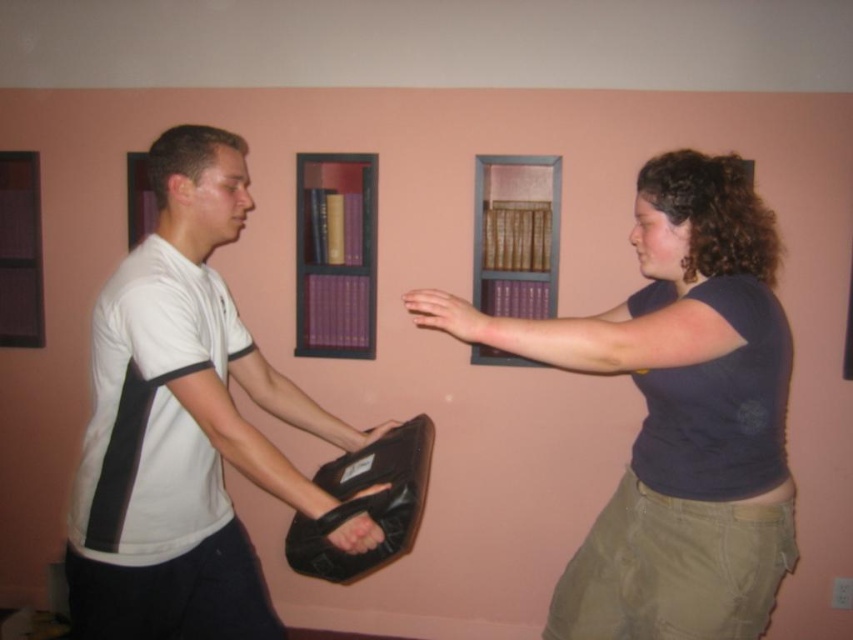
Is smooth skin hand at center positioned at the back of leather at center?

No.

Is smooth skin hand at center bigger than leather at center?

Yes, smooth skin hand at center is bigger than leather at center.

Image resolution: width=853 pixels, height=640 pixels. In order to click on smooth skin hand at center in this screenshot , I will do `click(450, 316)`.

This screenshot has width=853, height=640. Identify the location of purple matte bookshelf at upper center. (515, 234).

Does purple matte bookshelf at upper center appear on the right side of matte black bag at center?

Correct, you'll find purple matte bookshelf at upper center to the right of matte black bag at center.

Who is more forward, (515, 241) or (387, 428)?

Point (387, 428) is in front.

The image size is (853, 640). What are the coordinates of `purple matte bookshelf at upper center` in the screenshot? It's located at (515, 234).

Describe the element at coordinates (180, 422) in the screenshot. I see `white matte shirt at center` at that location.

Is point (160, 316) farther from viewer compared to point (351, 428)?

No, (160, 316) is in front of (351, 428).

Locate an element on the screen. The height and width of the screenshot is (640, 853). white matte shirt at center is located at coordinates pyautogui.click(x=180, y=422).